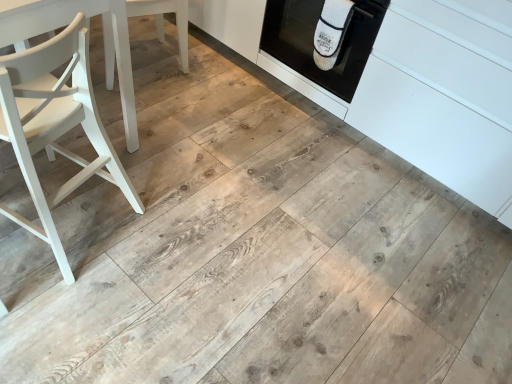
What are the coordinates of `vacant area to the right of white painted wood chair at left, which ranks as the 2th chair in top-to-bottom order` in the screenshot? It's located at (170, 239).